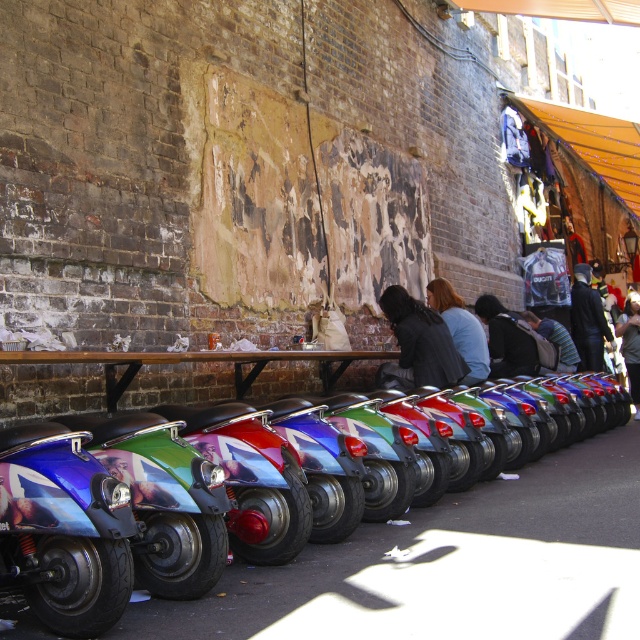
You are a delivery person who needs to place a small package between the dark gray hoodie at center and the dark gray sweater at center on the wooden table. Based on their sizes, which object should you place the package closer to?

The dark gray hoodie at center is much taller than the dark gray sweater at center, so you should place the package closer to the sweater to avoid it being knocked over by the taller hoodie.

You are a customer at a flea market and see two jackets displayed on a table in front of a brick wall. The jackets are the blue fabric jacket at center and the dark blue leather jacket at center. Which jacket is positioned to the left?

The blue fabric jacket at center is positioned to the left of the dark blue leather jacket at center.